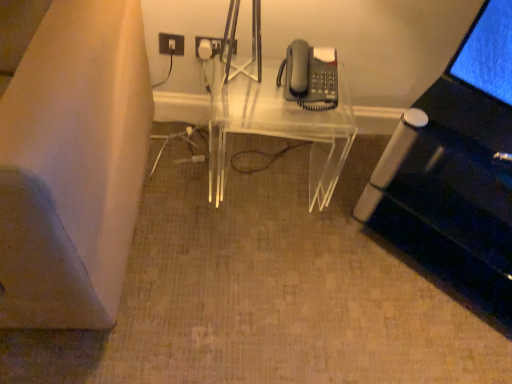
Locate an element on the screen. Image resolution: width=512 pixels, height=384 pixels. free area below transparent acrylic table at center (from a real-world perspective) is located at coordinates (274, 164).